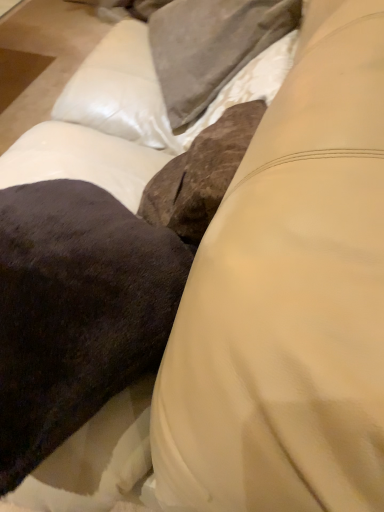
What do you see at coordinates (76, 311) in the screenshot? I see `velvety dark brown pillow at center` at bounding box center [76, 311].

In order to face velvety dark brown pillow at center, should I rotate leftwards or rightwards?

It's best to rotate left around 21.606 degrees.

The width and height of the screenshot is (384, 512). Identify the location of velvety dark brown pillow at center. (76, 311).

Where is `satin gray pillow at upper center`? This screenshot has height=512, width=384. satin gray pillow at upper center is located at coordinates 211,46.

What is the approximate width of satin gray pillow at upper center?

39.96 centimeters.

Describe the element at coordinates (211, 46) in the screenshot. This screenshot has width=384, height=512. I see `satin gray pillow at upper center` at that location.

This screenshot has height=512, width=384. Identify the location of velvety dark brown pillow at center. click(x=76, y=311).

Is velvety dark brown pillow at center to the right of satin gray pillow at upper center from the viewer's perspective?

No.

Considering the relative positions of velvety dark brown pillow at center and satin gray pillow at upper center in the image provided, is velvety dark brown pillow at center in front of satin gray pillow at upper center?

Yes.

In the scene shown: Which is closer to the camera, (26, 322) or (198, 10)?

Point (26, 322) is closer to the camera than point (198, 10).

From the image's perspective, is velvety dark brown pillow at center on top of satin gray pillow at upper center?

Incorrect, from the image's perspective, velvety dark brown pillow at center is lower than satin gray pillow at upper center.

From a real-world perspective, is velvety dark brown pillow at center positioned above or below satin gray pillow at upper center?

velvety dark brown pillow at center is situated higher than satin gray pillow at upper center in the real world.

Can you confirm if velvety dark brown pillow at center is wider than satin gray pillow at upper center?

Indeed, velvety dark brown pillow at center has a greater width compared to satin gray pillow at upper center.

Who is shorter, velvety dark brown pillow at center or satin gray pillow at upper center?

With less height is velvety dark brown pillow at center.

Who is smaller, velvety dark brown pillow at center or satin gray pillow at upper center?

satin gray pillow at upper center is smaller.

From the picture: Choose the correct answer: Is velvety dark brown pillow at center inside satin gray pillow at upper center or outside it?

velvety dark brown pillow at center cannot be found inside satin gray pillow at upper center.

Does velvety dark brown pillow at center touch satin gray pillow at upper center?

They are not placed beside each other.

Is velvety dark brown pillow at center oriented towards satin gray pillow at upper center?

No.

Where is `throw pillow that is above the satin gray pillow at upper center (from a real-world perspective)`? The height and width of the screenshot is (512, 384). throw pillow that is above the satin gray pillow at upper center (from a real-world perspective) is located at coordinates (76, 311).

Is satin gray pillow at upper center at the left side of velvety dark brown pillow at center?

Incorrect, satin gray pillow at upper center is not on the left side of velvety dark brown pillow at center.

In the image, is satin gray pillow at upper center positioned in front of or behind velvety dark brown pillow at center?

In the image, satin gray pillow at upper center appears behind velvety dark brown pillow at center.

Does point (207, 94) come behind point (146, 366)?

Yes, it is behind point (146, 366).

From the image's perspective, relative to velvety dark brown pillow at center, is satin gray pillow at upper center above or below?

satin gray pillow at upper center is situated higher than velvety dark brown pillow at center in the image.

From a real-world perspective, which is physically below, satin gray pillow at upper center or velvety dark brown pillow at center?

satin gray pillow at upper center is physically lower.

Which of these two, satin gray pillow at upper center or velvety dark brown pillow at center, is wider?

velvety dark brown pillow at center.

Between satin gray pillow at upper center and velvety dark brown pillow at center, which one has less height?

With less height is velvety dark brown pillow at center.

Between satin gray pillow at upper center and velvety dark brown pillow at center, which one has larger size?

With larger size is velvety dark brown pillow at center.

Is satin gray pillow at upper center surrounding velvety dark brown pillow at center?

No, satin gray pillow at upper center does not contain velvety dark brown pillow at center.

Is satin gray pillow at upper center far away from velvety dark brown pillow at center?

Actually, satin gray pillow at upper center and velvety dark brown pillow at center are a little close together.

Is satin gray pillow at upper center facing towards velvety dark brown pillow at center?

No, satin gray pillow at upper center is not aimed at velvety dark brown pillow at center.

At what (x,y) coordinates should I click in order to perform the action: click on throw pillow in front of the satin gray pillow at upper center. Please return your answer as a coordinate pair (x, y). Looking at the image, I should click on (76, 311).

Image resolution: width=384 pixels, height=512 pixels. There is a satin gray pillow at upper center. Find the location of `throw pillow above it (from a real-world perspective)`. throw pillow above it (from a real-world perspective) is located at coordinates (76, 311).

The image size is (384, 512). What are the coordinates of `pillow that appears below the velvety dark brown pillow at center (from a real-world perspective)` in the screenshot? It's located at (211, 46).